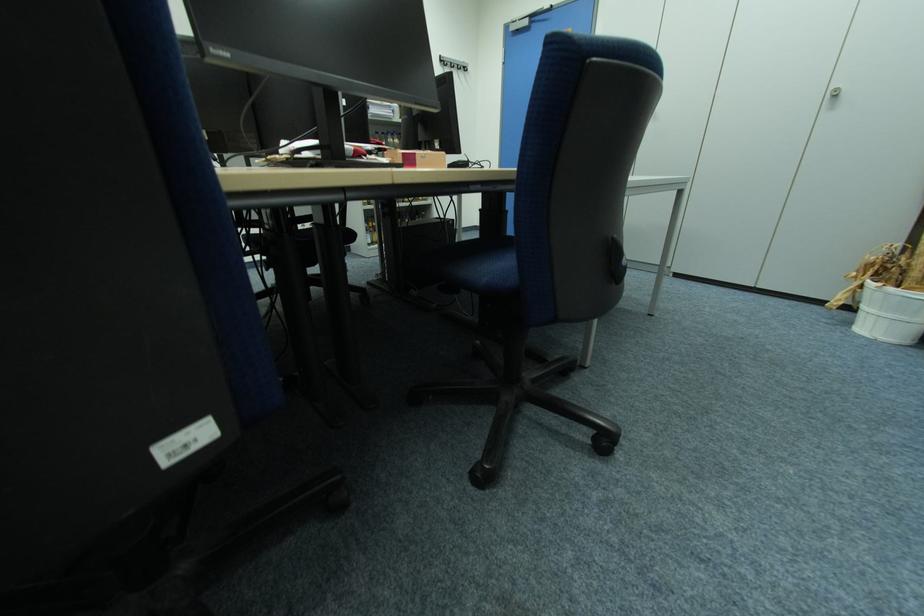
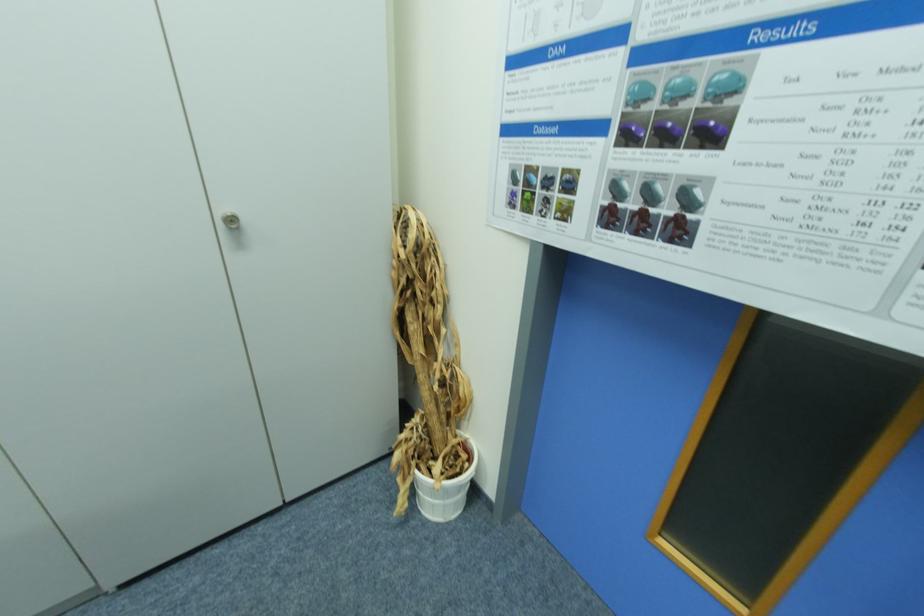
Locate, in the second image, the point that corresponds to [879,286] in the first image.

(430, 477)